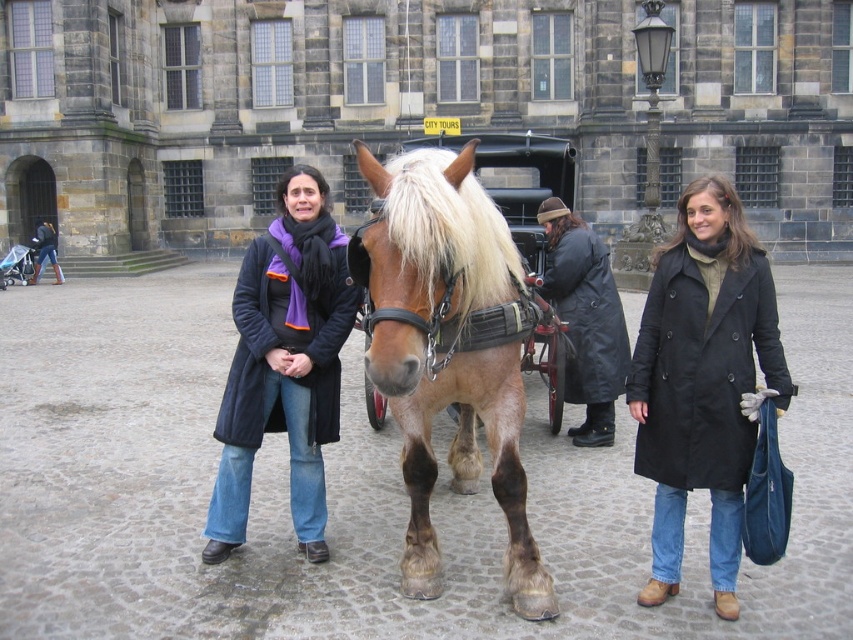
Question: Is black coat at center to the right of dark gray coat at center from the viewer's perspective?

Choices:
 (A) no
 (B) yes

Answer: (B)

Question: Among these objects, which one is farthest from the camera?

Choices:
 (A) matte black coat at center
 (B) brown glossy horse at center
 (C) dark gray coat at center
 (D) black coat at center

Answer: (C)

Question: Does black coat at center appear on the right side of dark gray coat at center?

Choices:
 (A) no
 (B) yes

Answer: (B)

Question: Does brown glossy horse at center lie behind matte black coat at center?

Choices:
 (A) no
 (B) yes

Answer: (A)

Question: Among these objects, which one is nearest to the camera?

Choices:
 (A) black coat at center
 (B) matte black coat at center

Answer: (A)

Question: Which point appears closest to the camera in this image?

Choices:
 (A) (595, 275)
 (B) (387, 340)
 (C) (264, 262)

Answer: (B)